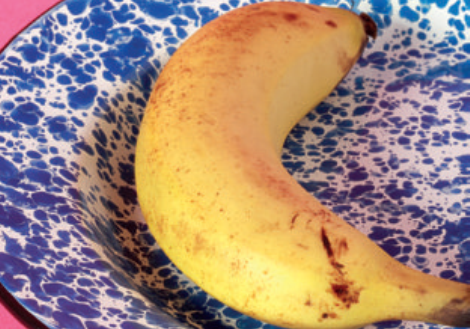
Where is `plate`? The image size is (470, 329). plate is located at coordinates (75, 154).